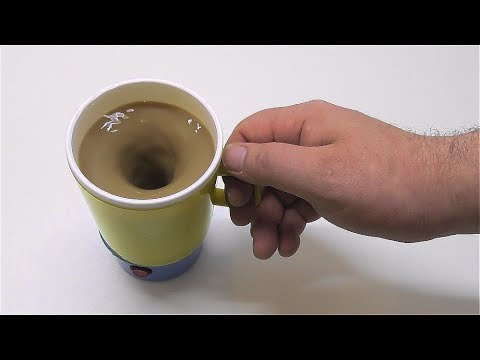
Image resolution: width=480 pixels, height=360 pixels. Find the location of `cup warmer`. cup warmer is located at coordinates (163, 274).